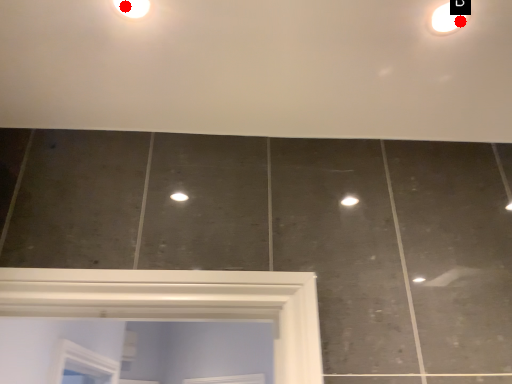
Question: Two points are circled on the image, labeled by A and B beside each circle. Which point appears closest to the camera in this image?

Choices:
 (A) A is closer
 (B) B is closer

Answer: (A)